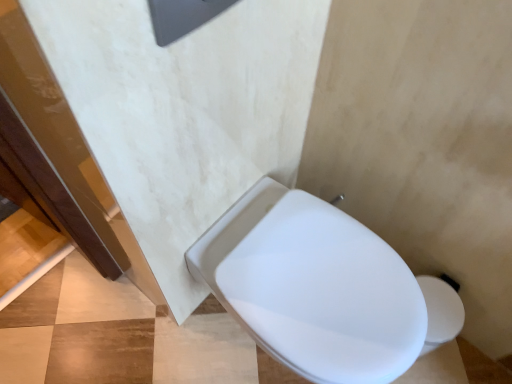
Question: From the image's perspective, is white glossy toilet at lower right positioned above or below white glossy toilet at center?

Choices:
 (A) above
 (B) below

Answer: (B)

Question: From a real-world perspective, is white glossy toilet at lower right above or below white glossy toilet at center?

Choices:
 (A) below
 (B) above

Answer: (A)

Question: Which is correct: white glossy toilet at lower right is inside white glossy toilet at center, or outside of it?

Choices:
 (A) outside
 (B) inside

Answer: (A)

Question: Is white glossy toilet at center to the left or to the right of white glossy toilet at lower right in the image?

Choices:
 (A) left
 (B) right

Answer: (B)

Question: From the image's perspective, is white glossy toilet at center located above or below white glossy toilet at lower right?

Choices:
 (A) above
 (B) below

Answer: (A)

Question: In terms of width, does white glossy toilet at center look wider or thinner when compared to white glossy toilet at lower right?

Choices:
 (A) thin
 (B) wide

Answer: (A)

Question: Considering the positions of point [401, 360] and point [150, 349], is point [401, 360] closer or farther from the camera than point [150, 349]?

Choices:
 (A) closer
 (B) farther

Answer: (A)